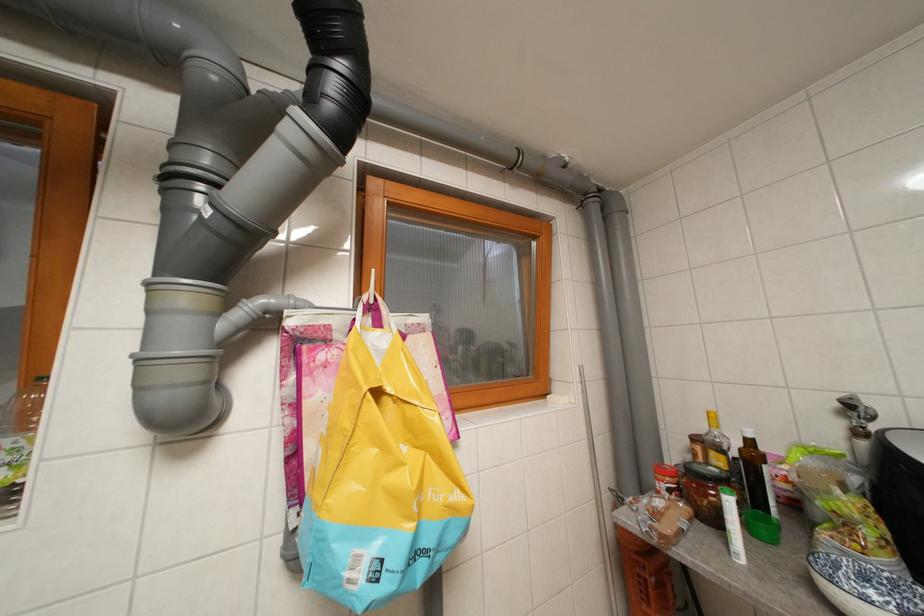
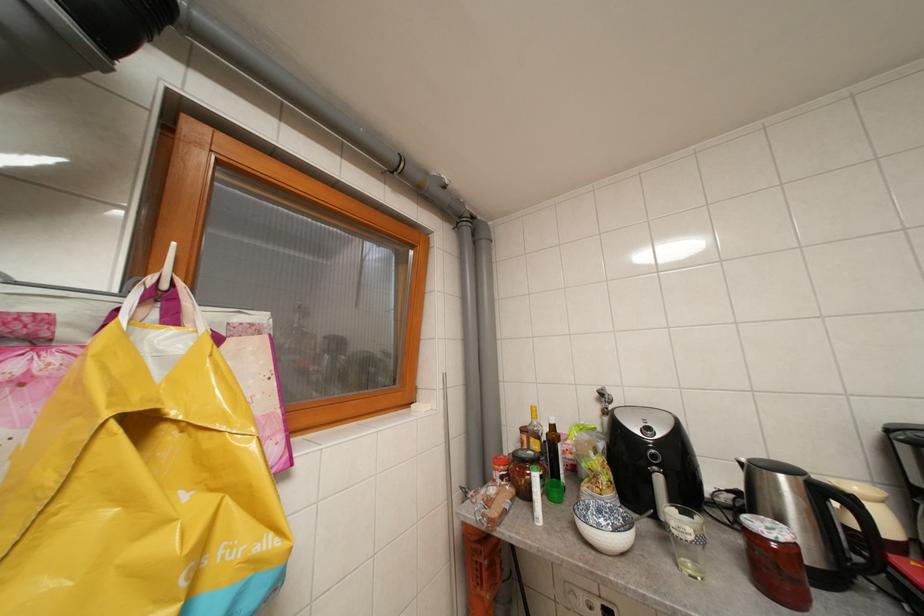
Question: The images are taken continuously from a first-person perspective. In which direction are you moving?

Choices:
 (A) Left
 (B) Right
 (C) Forward
 (D) Backward

Answer: (B)